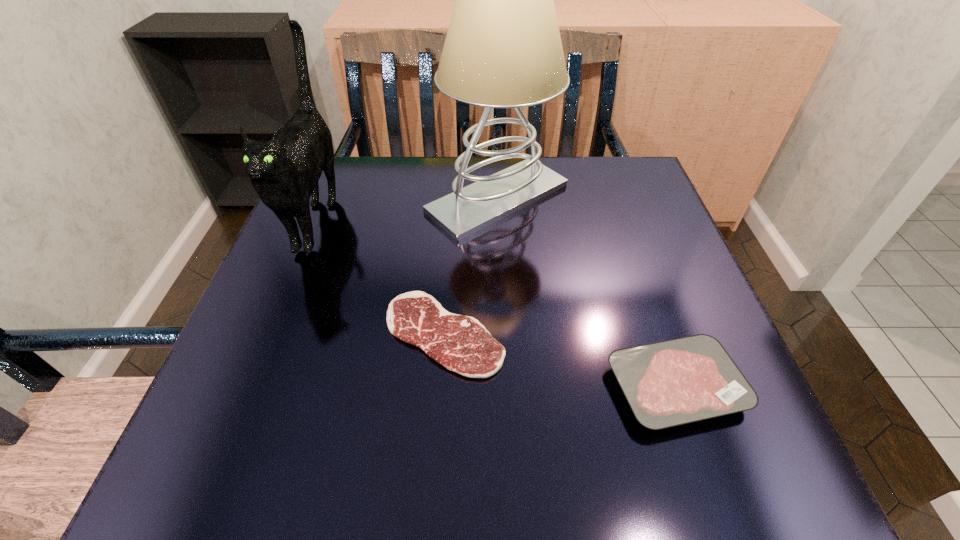
Where is `blank area located 0.130m on the left of the shortest object`? The height and width of the screenshot is (540, 960). blank area located 0.130m on the left of the shortest object is located at coordinates (309, 334).

You are a GUI agent. You are given a task and a screenshot of the screen. Output one action in this format:
    pyautogui.click(x=<x>, y=<y>)
    Task: Click on the table lamp present at the far edge
    The image size is (960, 540).
    Given the screenshot: What is the action you would take?
    pyautogui.click(x=503, y=49)

Identify the location of cat present at the far edge. The image size is (960, 540). (284, 171).

At what (x,y) coordinates should I click in order to perform the action: click on object present at the near edge. Please return your answer as a coordinate pair (x, y). Looking at the image, I should click on (678, 381).

At what (x,y) coordinates should I click in order to perform the action: click on object located at the left edge. Please return your answer as a coordinate pair (x, y). This screenshot has height=540, width=960. Looking at the image, I should click on (284, 171).

Locate an element on the screen. object at the right edge is located at coordinates (678, 381).

What are the coordinates of `object at the far left corner` in the screenshot? It's located at (284, 171).

Find the location of a particular element. Image resolution: width=960 pixels, height=540 pixels. object that is at the near right corner is located at coordinates (678, 381).

Image resolution: width=960 pixels, height=540 pixels. In the image, there is a desktop. Find the location of `vacant area at the far edge`. vacant area at the far edge is located at coordinates (432, 190).

At what (x,y) coordinates should I click in order to perform the action: click on free region at the near edge. Please return your answer as a coordinate pair (x, y). The width and height of the screenshot is (960, 540). Looking at the image, I should click on (488, 445).